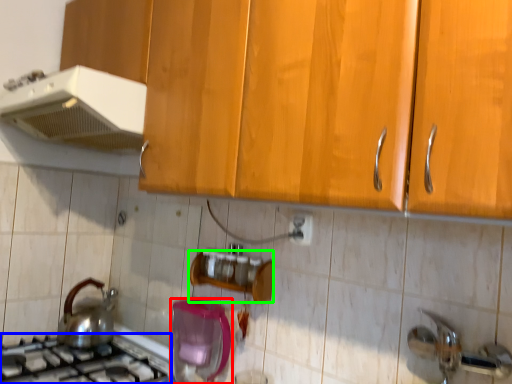
Question: Considering the real-world distances, which object is closest to kitchen appliance (highlighted by a red box)? gas stove (highlighted by a blue box) or shelf (highlighted by a green box).

Choices:
 (A) gas stove
 (B) shelf

Answer: (B)